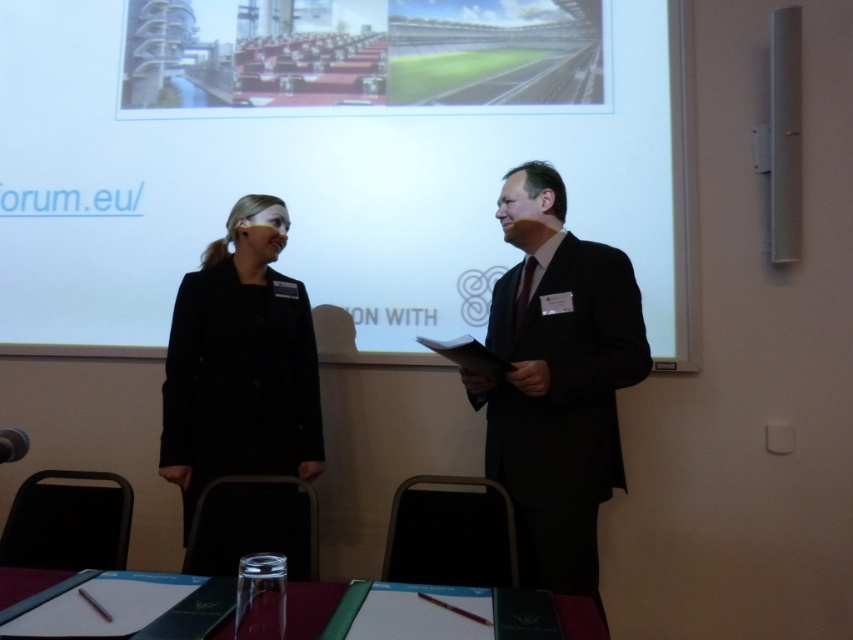
Question: Is white matte projection screen at upper center wider than black suit at center?

Choices:
 (A) no
 (B) yes

Answer: (B)

Question: Does black suit at center appear on the right side of black matte coat at center?

Choices:
 (A) yes
 (B) no

Answer: (A)

Question: Which object is farther from the camera taking this photo?

Choices:
 (A) black matte coat at center
 (B) white matte projection screen at upper center

Answer: (B)

Question: Observing the image, what is the correct spatial positioning of white matte projection screen at upper center in reference to black matte coat at center?

Choices:
 (A) below
 (B) above

Answer: (B)

Question: Among these points, which one is farthest from the camera?

Choices:
 (A) (526, 260)
 (B) (216, 340)
 (C) (680, 19)

Answer: (C)

Question: Which point is closer to the camera taking this photo?

Choices:
 (A) (595, 269)
 (B) (200, 429)

Answer: (A)